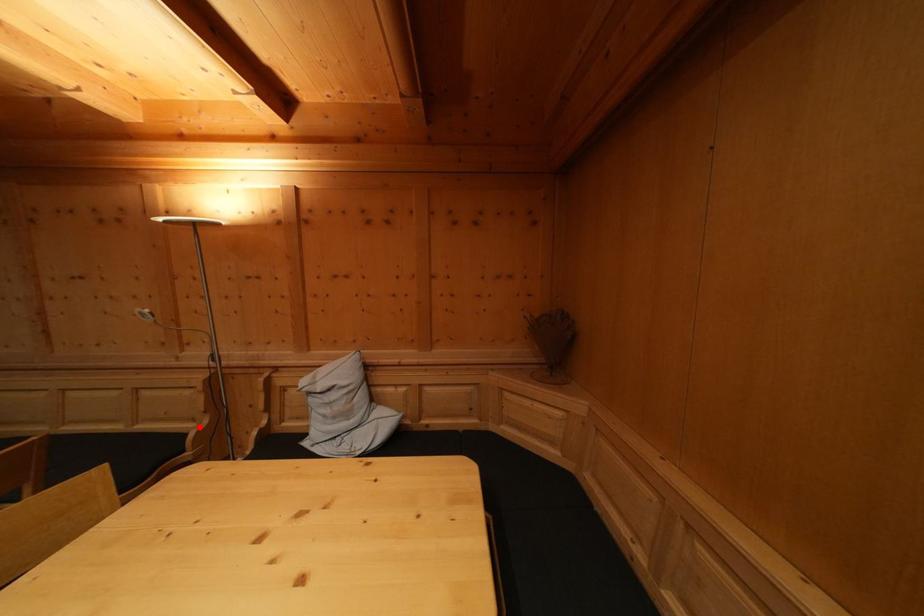
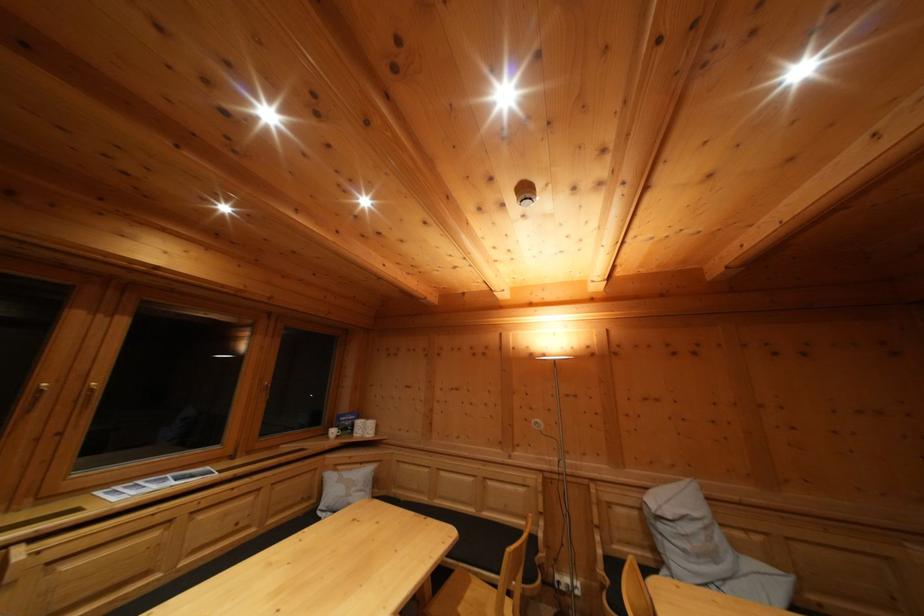
Question: I am providing you with two images of the same scene from different viewpoints. Image1 has a red point marked. In image2, the corresponding 3D location appears at what relative position? Reply with the corresponding letter.

Choices:
 (A) Closer
 (B) Farther

Answer: (B)